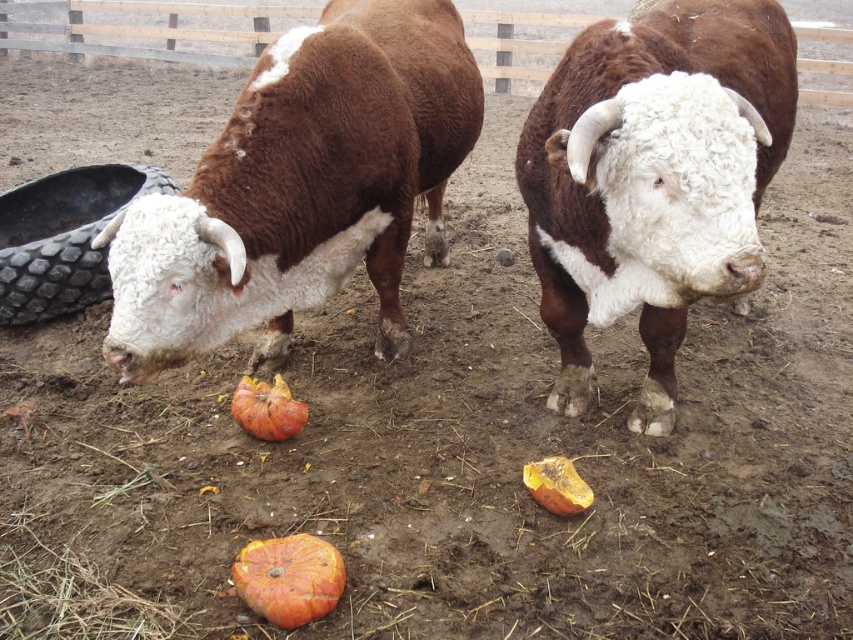
Is brown woolly bull at center taller than orange rough pumpkin at center?

Yes.

Between point (683, 294) and point (253, 605), which one is positioned in front?

Positioned in front is point (253, 605).

This screenshot has height=640, width=853. Identify the location of brown woolly bull at center. (653, 179).

From the picture: Does black rubber tire at left have a lesser height compared to orange rough pumpkin at center?

No, black rubber tire at left is not shorter than orange rough pumpkin at center.

Can you confirm if black rubber tire at left is wider than orange rough pumpkin at center?

Correct, the width of black rubber tire at left exceeds that of orange rough pumpkin at center.

What do you see at coordinates (62, 236) in the screenshot? I see `black rubber tire at left` at bounding box center [62, 236].

The width and height of the screenshot is (853, 640). In order to click on black rubber tire at left in this screenshot , I will do `click(62, 236)`.

Which is behind, point (686, 74) or point (274, 404)?

Positioned behind is point (274, 404).

Who is positioned more to the left, brown woolly bull at center or orange matte pumpkin at center?

orange matte pumpkin at center is more to the left.

Is point (547, 129) closer to camera compared to point (296, 420)?

Yes, it is in front of point (296, 420).

The image size is (853, 640). I want to click on brown woolly bull at center, so click(653, 179).